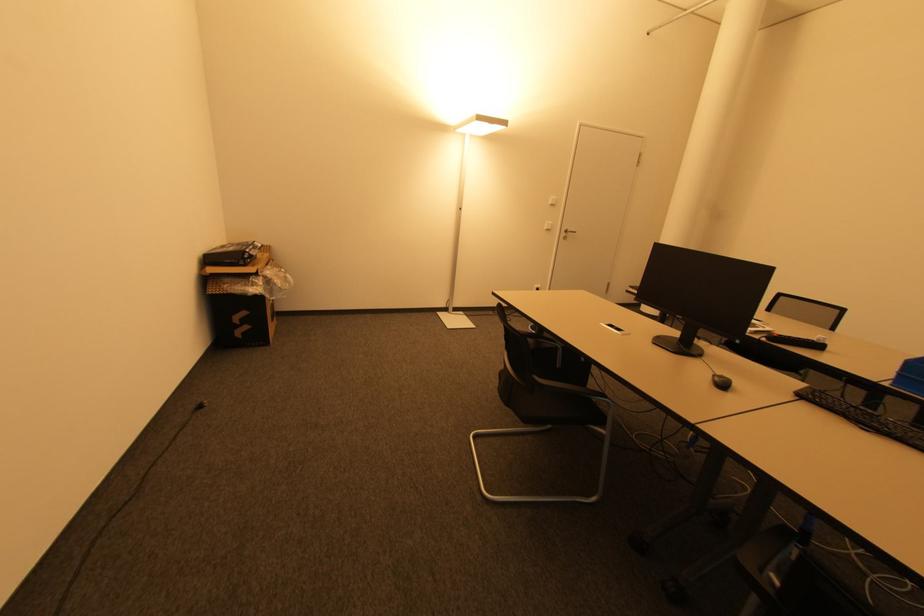
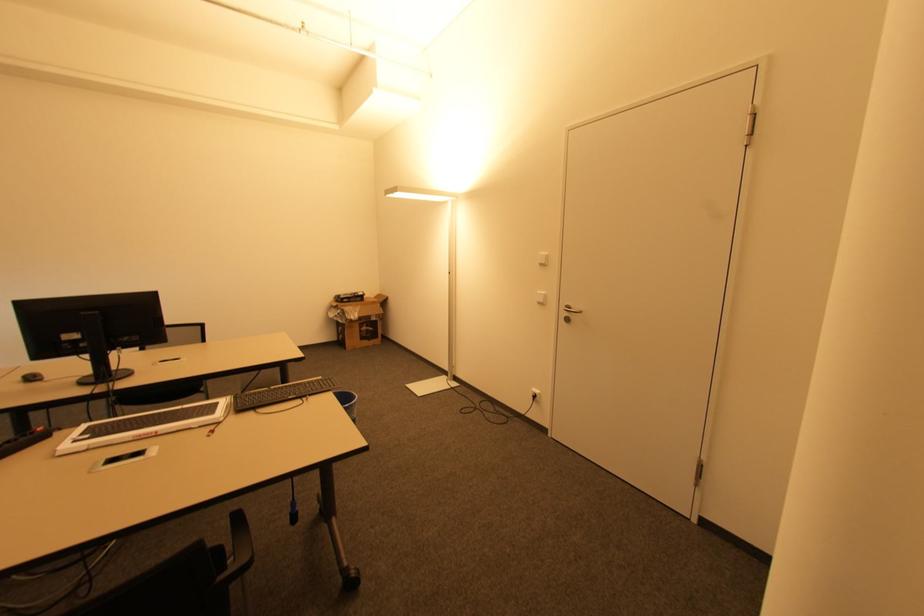
Find the pixel in the second image that matches the point at 541,286 in the first image.

(539, 392)